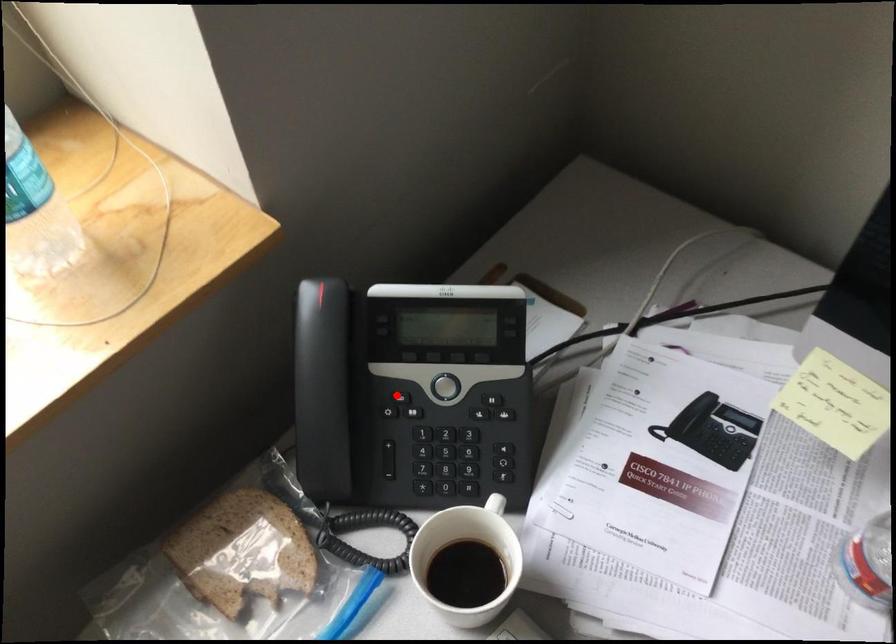
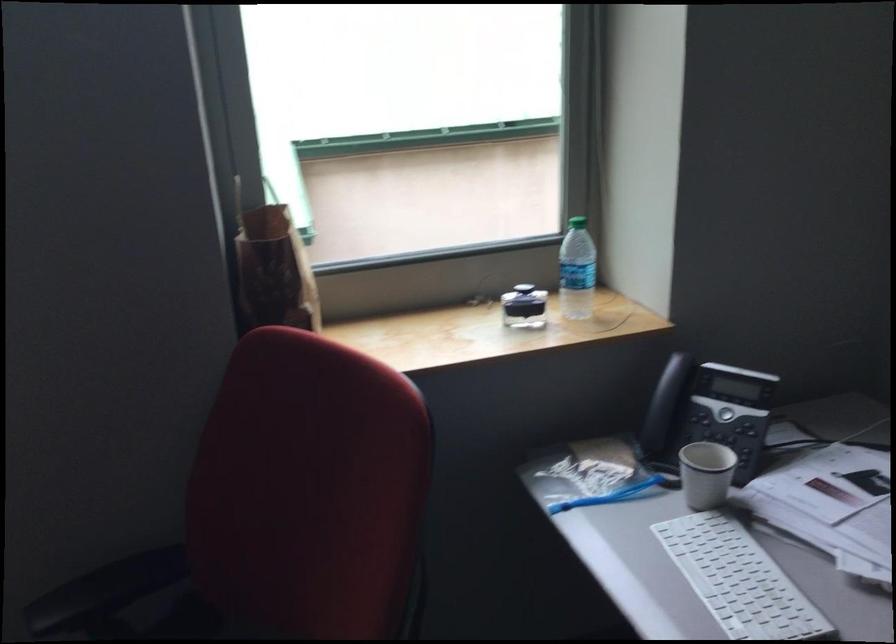
Locate, in the second image, the point that corresponds to the highlighted location in the first image.

(707, 413)